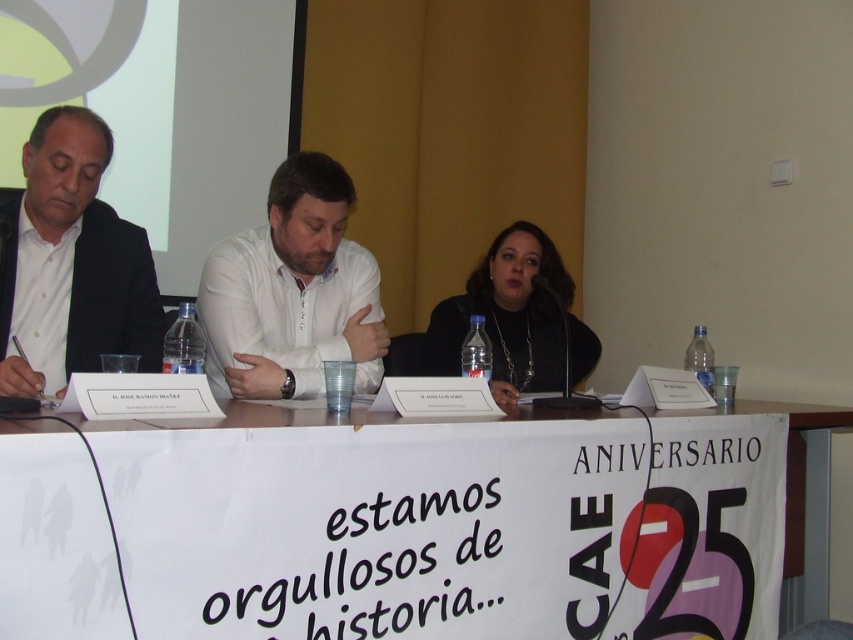
You are a photographer at this event and need to capture a closeup of the white paper banner at center and the matte black jacket at center. The camera you are using has a minimum focus distance of 30 inches. Can you focus on both objects without moving the camera?

The white paper banner at center and matte black jacket at center are 30.84 inches apart. Since the distance between them is greater than the camera minimum focus distance of 30 inches, you can focus on both objects without moving the camera.

You are a photographer adjusting your camera to capture the banner with the text and logo at the event. You notice two points marked on the banner. Which point is closer to you, point (306, 163) or point (459, 337)?

Point (306, 163) is closer to the viewer than point (459, 337).